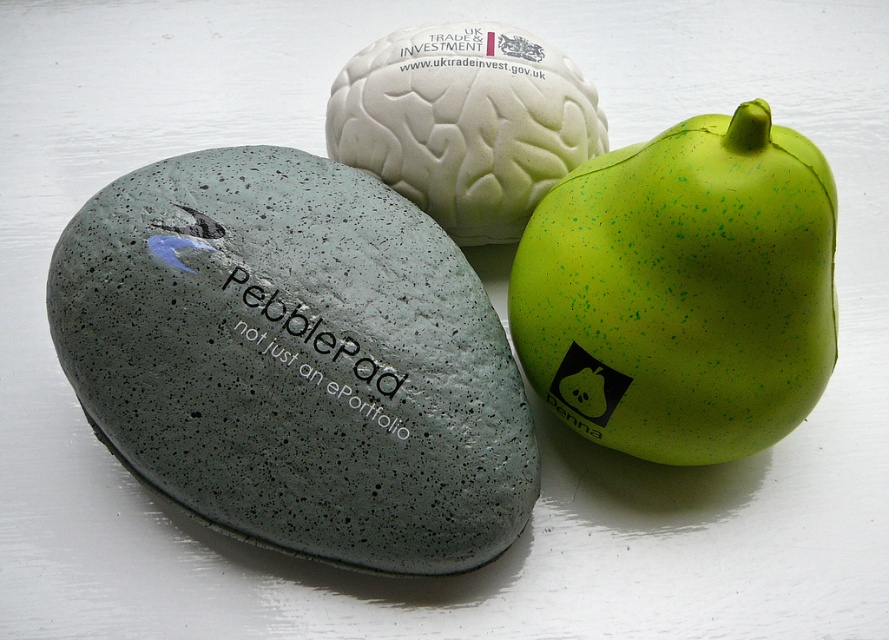
You are organizing a science fair display and need to arrange the green speckled rubber at center right and the white matte brain at center on a table. Based on their positions, which object is closer to the front of the table?

The green speckled rubber at center right is closer to the front of the table because it is in front of the white matte brain at center according to the description.